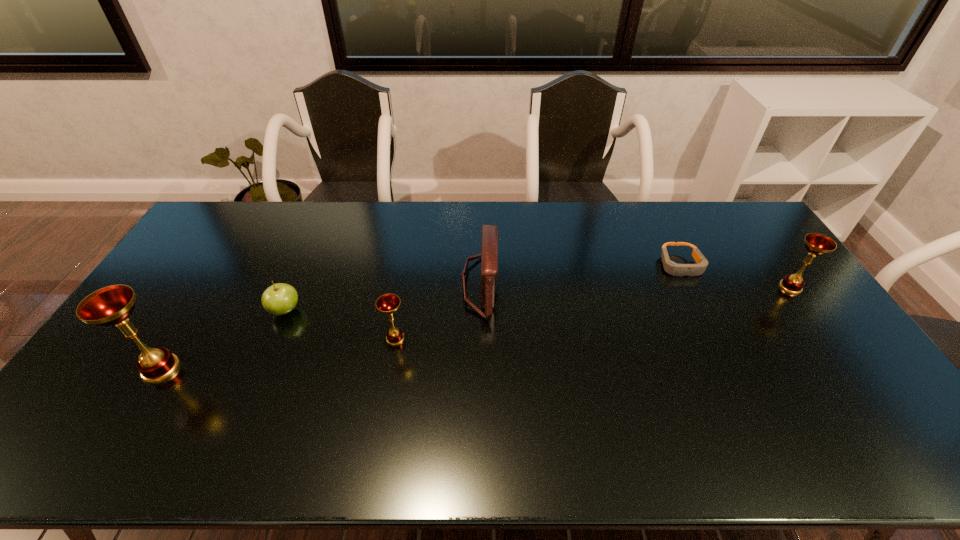
Identify the location of unoccupied position between the second shortest object and the second nearest chalice. This screenshot has height=540, width=960. (340, 325).

Locate an element on the screen. This screenshot has width=960, height=540. empty space that is in between the shoulder bag and the nearest chalice is located at coordinates (321, 327).

Locate an element on the screen. This screenshot has width=960, height=540. free point between the shoulder bag and the second farthest chalice is located at coordinates (438, 311).

At what (x,y) coordinates should I click in order to perform the action: click on free space between the shortest chalice and the fifth tallest object. Please return your answer as a coordinate pair (x, y). This screenshot has width=960, height=540. Looking at the image, I should click on (340, 325).

Where is `vacant space in between the second tallest chalice and the shoulder bag`? vacant space in between the second tallest chalice and the shoulder bag is located at coordinates (636, 286).

Locate an element on the screen. The image size is (960, 540). free space between the fifth tallest object and the second farthest chalice is located at coordinates (340, 325).

In order to click on vacant space in between the nearest chalice and the rightmost object in this screenshot , I will do `click(475, 328)`.

Identify the location of the fifth closest object relative to the shoulder bag. This screenshot has height=540, width=960. (816, 244).

Identify the location of object that stands as the third closest to the fifth object from right to left. The width and height of the screenshot is (960, 540). (489, 240).

Where is `chalice that is the second nearest to the rightmost chalice`? Image resolution: width=960 pixels, height=540 pixels. chalice that is the second nearest to the rightmost chalice is located at coordinates (112, 305).